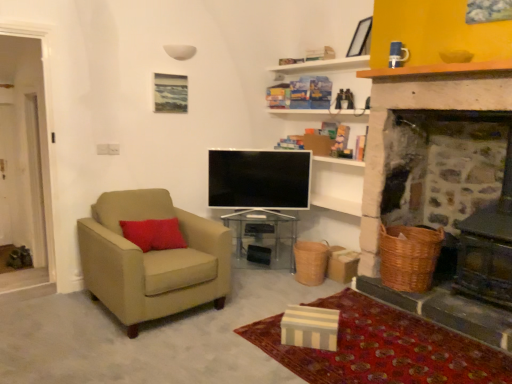
The width and height of the screenshot is (512, 384). I want to click on free space on the front side of beige fabric armchair at left, so click(128, 345).